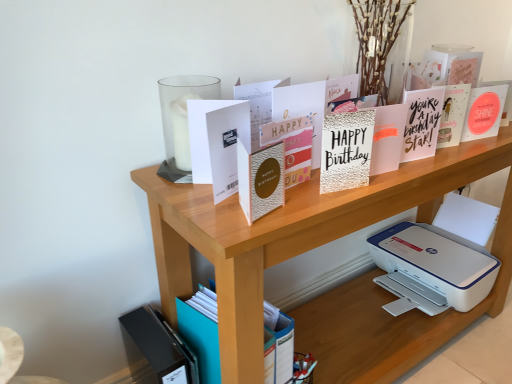
Question: From the image's perspective, is wooden shelf at upper center on top of matte white card at upper right, which appears as the 8th paperback book when viewed from the left?

Choices:
 (A) yes
 (B) no

Answer: (B)

Question: From a real-world perspective, is wooden shelf at upper center positioned over matte white card at upper right, which appears as the 8th paperback book when viewed from the left, based on gravity?

Choices:
 (A) no
 (B) yes

Answer: (A)

Question: Can you confirm if wooden shelf at upper center is wider than matte white card at upper right, which appears as the 8th paperback book when viewed from the left?

Choices:
 (A) yes
 (B) no

Answer: (A)

Question: From the image's perspective, is wooden shelf at upper center under matte white card at upper right, the first paperback book when ordered from right to left?

Choices:
 (A) yes
 (B) no

Answer: (A)

Question: Can you confirm if wooden shelf at upper center is shorter than matte white card at upper right, the first paperback book when ordered from right to left?

Choices:
 (A) yes
 (B) no

Answer: (B)

Question: Looking at their shapes, would you say matte gold card at center, the 4th paperback book positioned from the right, is wider or thinner than matte white card at upper right, which appears as the 8th paperback book when viewed from the left?

Choices:
 (A) thin
 (B) wide

Answer: (A)

Question: From the image's perspective, is matte gold card at center, the 4th paperback book positioned from the right, above or below matte white card at upper right, the first paperback book when ordered from right to left?

Choices:
 (A) below
 (B) above

Answer: (A)

Question: Considering the positions of matte gold card at center, the 4th paperback book positioned from the right, and matte white card at upper right, the first paperback book when ordered from right to left, in the image, is matte gold card at center, the 4th paperback book positioned from the right, taller or shorter than matte white card at upper right, the first paperback book when ordered from right to left,?

Choices:
 (A) tall
 (B) short

Answer: (A)

Question: From a real-world perspective, relative to matte white card at upper right, the first paperback book when ordered from right to left, is matte gold card at center, the fifth paperback book when ordered from left to right, vertically above or below?

Choices:
 (A) below
 (B) above

Answer: (B)

Question: Visually, is black matte journal at lower left positioned to the left or to the right of white matte card at upper center, which is counted as the 1th paperback book, starting from the left?

Choices:
 (A) left
 (B) right

Answer: (A)

Question: In terms of height, does black matte journal at lower left look taller or shorter compared to white matte card at upper center, acting as the 8th paperback book starting from the right?

Choices:
 (A) tall
 (B) short

Answer: (A)

Question: Is black matte journal at lower left inside the boundaries of white matte card at upper center, acting as the 8th paperback book starting from the right, or outside?

Choices:
 (A) inside
 (B) outside

Answer: (B)

Question: From the image's perspective, is black matte journal at lower left positioned above or below white matte card at upper center, acting as the 8th paperback book starting from the right?

Choices:
 (A) below
 (B) above

Answer: (A)

Question: Considering the relative positions of wooden shelf at upper center and white matte card at center, acting as the 7th paperback book starting from the right, in the image provided, is wooden shelf at upper center to the left or to the right of white matte card at center, acting as the 7th paperback book starting from the right,?

Choices:
 (A) left
 (B) right

Answer: (B)

Question: From a real-world perspective, is wooden shelf at upper center above or below white matte card at center, positioned as the 2th paperback book in left-to-right order?

Choices:
 (A) below
 (B) above

Answer: (A)